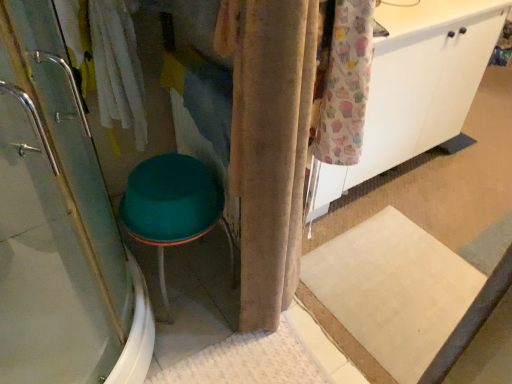
Question: From a real-world perspective, is velvet beige curtain at center positioned above or below white matte cabinet at upper right?

Choices:
 (A) below
 (B) above

Answer: (A)

Question: Considering the positions of point (290, 41) and point (453, 99), is point (290, 41) closer or farther from the camera than point (453, 99)?

Choices:
 (A) closer
 (B) farther

Answer: (A)

Question: Based on their relative distances, which object is farther from the teal plastic stool at lower left?

Choices:
 (A) white matte cabinet at upper right
 (B) velvet beige curtain at center
 (C) clear glass shower door at left

Answer: (A)

Question: Which is nearer to the teal plastic stool at lower left?

Choices:
 (A) velvet beige curtain at center
 (B) clear glass shower door at left
 (C) white matte cabinet at upper right

Answer: (A)